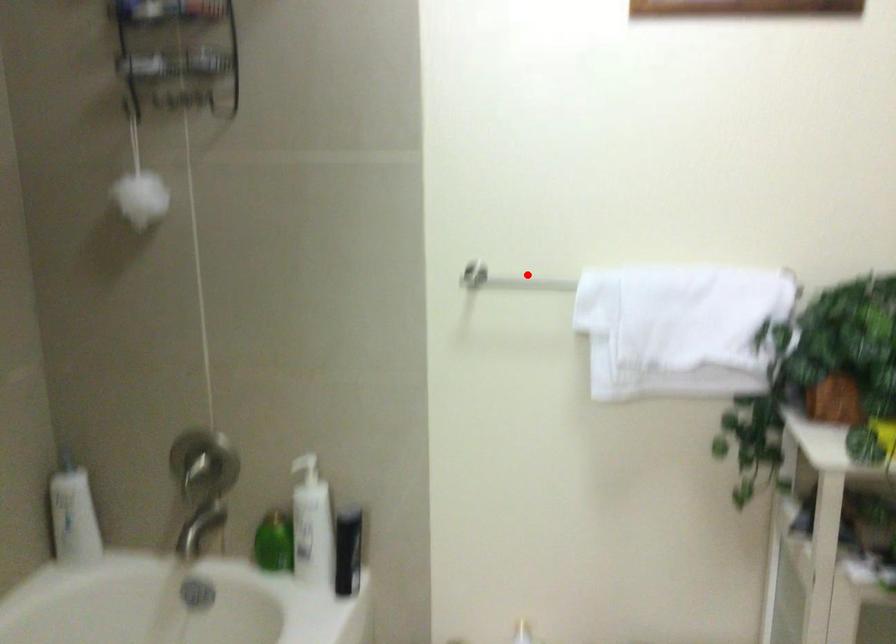
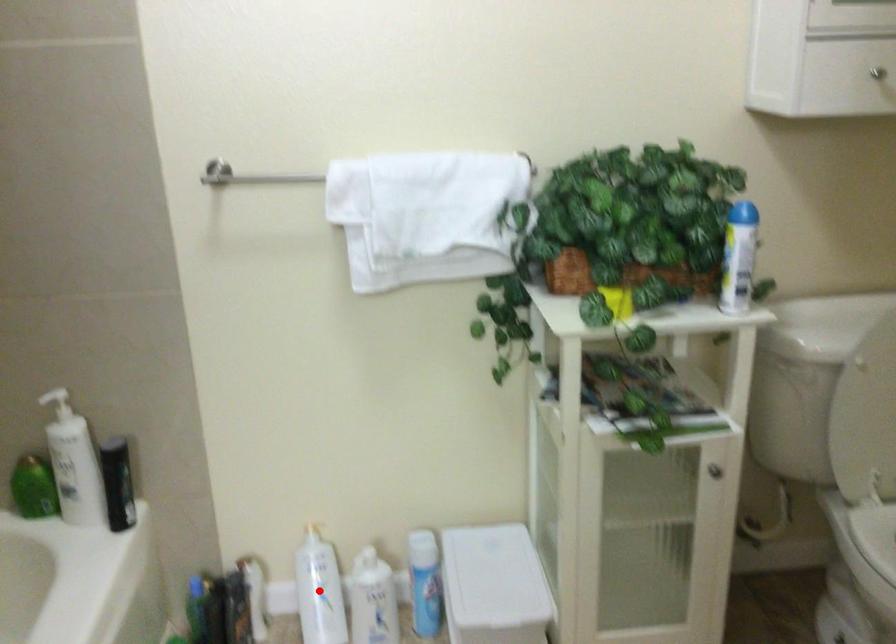
I am providing you with two images of the same scene from different viewpoints. A red point is marked on the first image and another point is marked on the second image. Does the point marked in image1 correspond to the same location as the one in image2?

No